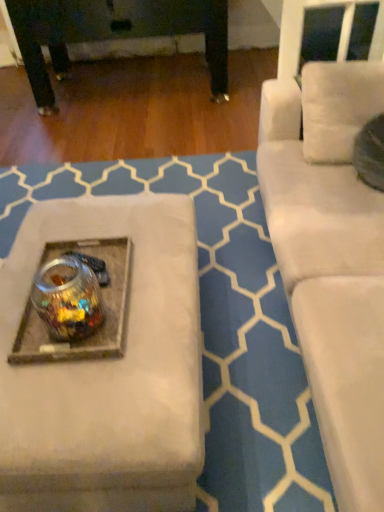
You are a GUI agent. You are given a task and a screenshot of the screen. Output one action in this format:
    pyautogui.click(x=<x>, y=<y>)
    Task: Click on the unoccupied area in front of transparent glass jar at center
    This screenshot has width=384, height=512.
    Given the screenshot: What is the action you would take?
    pyautogui.click(x=69, y=353)